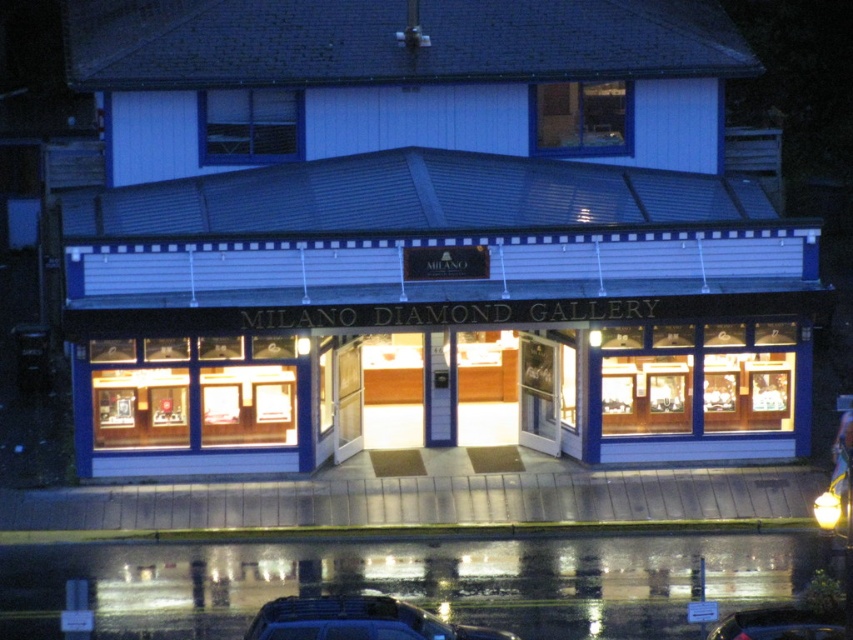
Question: Among these points, which one is farthest from the camera?

Choices:
 (A) (785, 624)
 (B) (279, 624)

Answer: (A)

Question: Can you confirm if shiny black car at lower center is positioned below shiny black car at lower right?

Choices:
 (A) no
 (B) yes

Answer: (A)

Question: Which object is closer to the camera taking this photo?

Choices:
 (A) shiny black car at lower center
 (B) shiny black car at lower right

Answer: (A)

Question: Which point is farther from the camera taking this photo?

Choices:
 (A) (804, 605)
 (B) (502, 634)

Answer: (A)

Question: Does shiny black car at lower center have a greater width compared to shiny black car at lower right?

Choices:
 (A) no
 (B) yes

Answer: (B)

Question: Is shiny black car at lower center below shiny black car at lower right?

Choices:
 (A) yes
 (B) no

Answer: (B)